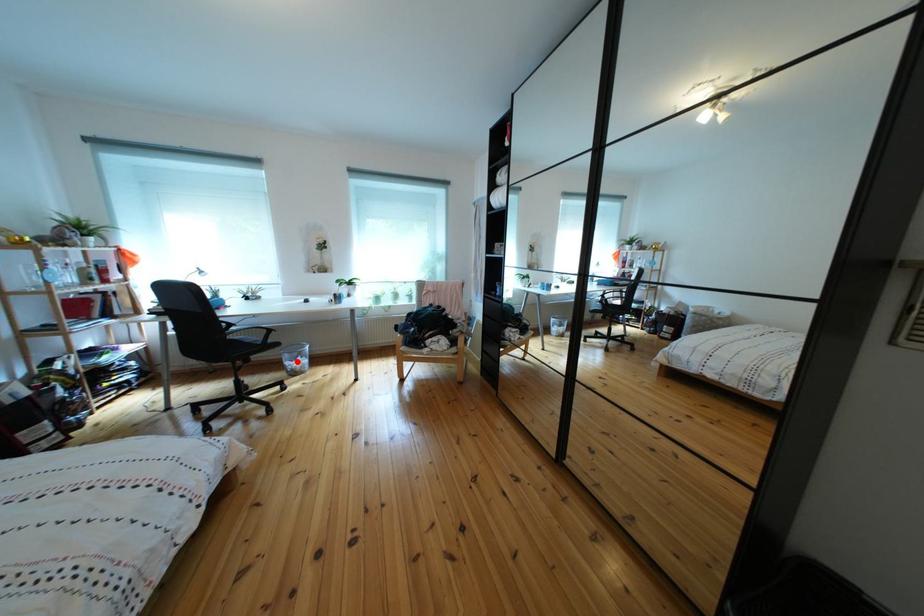
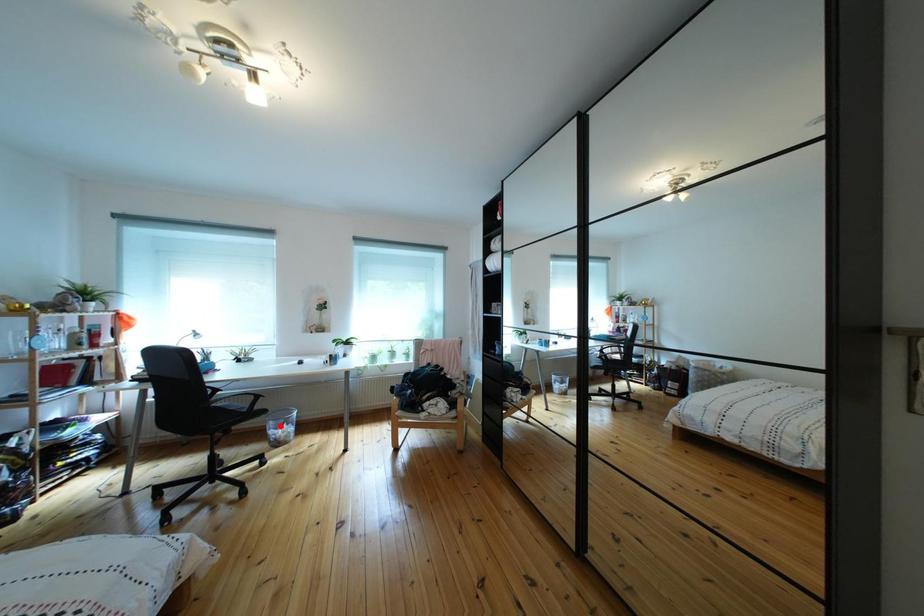
I am providing you with two images of the same scene from different viewpoints. A red point is marked on the first image and another point is marked on the second image. Does the point marked in image1 correspond to the same location as the one in image2?

No